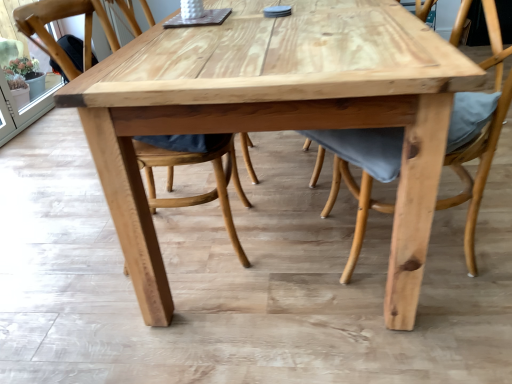
Question: Considering the relative sizes of natural wood chair at center, the 1th chair from the left, and natural wood chair at center, the 1th chair positioned from the right, in the image provided, is natural wood chair at center, the 1th chair from the left, shorter than natural wood chair at center, the 1th chair positioned from the right,?

Choices:
 (A) no
 (B) yes

Answer: (A)

Question: Is natural wood chair at center, the 1th chair from the left, bigger than natural wood chair at center, the 1th chair positioned from the right?

Choices:
 (A) yes
 (B) no

Answer: (B)

Question: Is natural wood chair at center, placed as the 2th chair when sorted from left to right, surrounded by natural wood chair at center, the 1th chair from the left?

Choices:
 (A) yes
 (B) no

Answer: (B)

Question: From a real-world perspective, is natural wood chair at center, which appears as the 2th chair when viewed from the right, over natural wood chair at center, placed as the 2th chair when sorted from left to right?

Choices:
 (A) no
 (B) yes

Answer: (B)

Question: Is natural wood chair at center, the 1th chair from the left, with natural wood chair at center, the 1th chair positioned from the right?

Choices:
 (A) yes
 (B) no

Answer: (B)

Question: From a real-world perspective, is natural wood chair at center, the 1th chair from the left, under natural wood chair at center, placed as the 2th chair when sorted from left to right?

Choices:
 (A) no
 (B) yes

Answer: (A)

Question: Is natural wood chair at center, placed as the 2th chair when sorted from left to right, with natural wood chair at center, the 1th chair from the left?

Choices:
 (A) yes
 (B) no

Answer: (B)

Question: Does natural wood chair at center, placed as the 2th chair when sorted from left to right, have a larger size compared to natural wood chair at center, which appears as the 2th chair when viewed from the right?

Choices:
 (A) no
 (B) yes

Answer: (B)

Question: Could natural wood chair at center, which appears as the 2th chair when viewed from the right, be considered to be inside natural wood chair at center, placed as the 2th chair when sorted from left to right?

Choices:
 (A) no
 (B) yes

Answer: (A)

Question: Is natural wood chair at center, placed as the 2th chair when sorted from left to right, smaller than natural wood chair at center, which appears as the 2th chair when viewed from the right?

Choices:
 (A) no
 (B) yes

Answer: (A)

Question: Can you confirm if natural wood chair at center, the 1th chair positioned from the right, is positioned to the right of natural wood chair at center, which appears as the 2th chair when viewed from the right?

Choices:
 (A) no
 (B) yes

Answer: (B)

Question: From the image's perspective, would you say natural wood chair at center, placed as the 2th chair when sorted from left to right, is shown under natural wood chair at center, the 1th chair from the left?

Choices:
 (A) yes
 (B) no

Answer: (A)

Question: In terms of width, does natural wood chair at center, the 1th chair positioned from the right, look wider or thinner when compared to natural wood chair at center, the 1th chair from the left?

Choices:
 (A) thin
 (B) wide

Answer: (B)